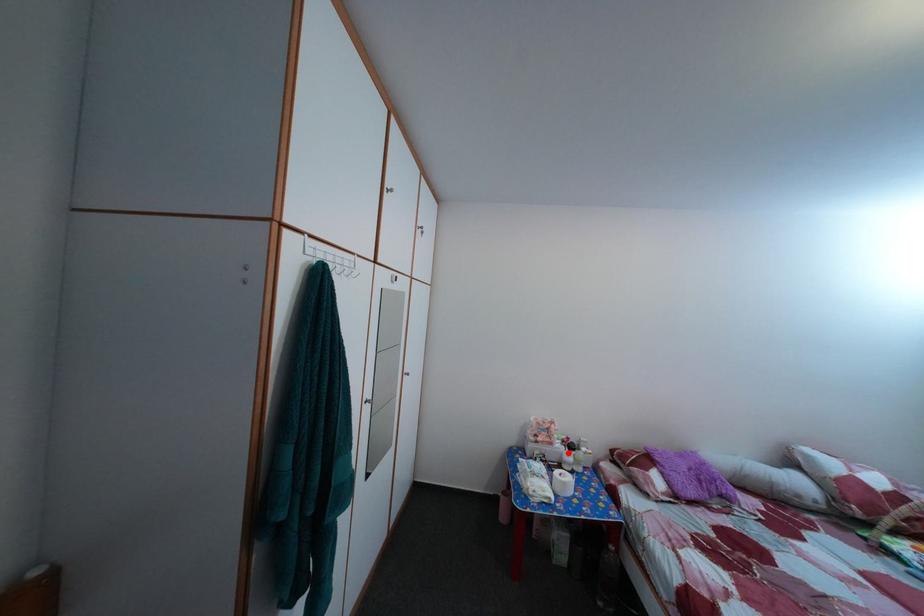
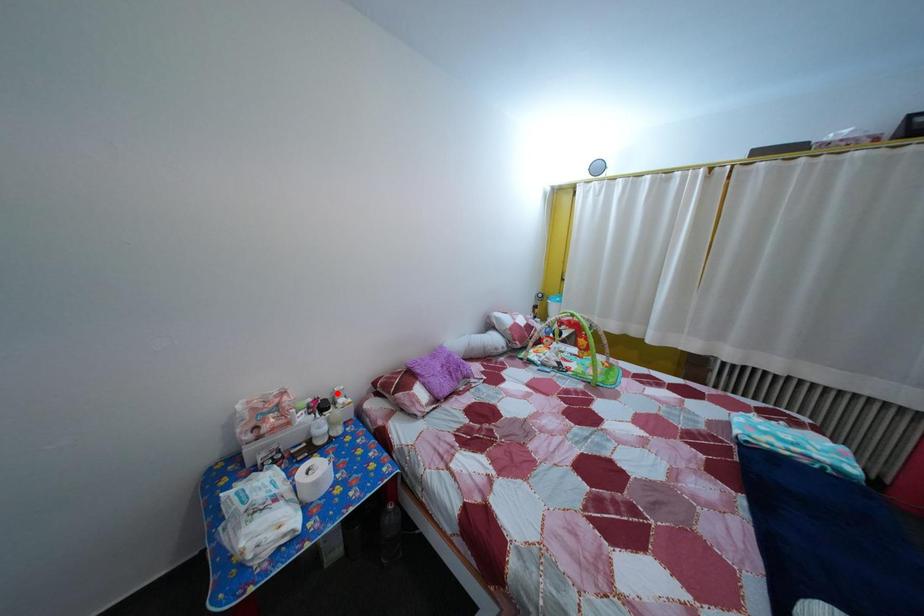
I am providing you with two images of the same scene from different viewpoints. A red point is marked on the first image and another point is marked on the second image. Do the highlighted points in image1 and image2 indicate the same real-world spot?

No